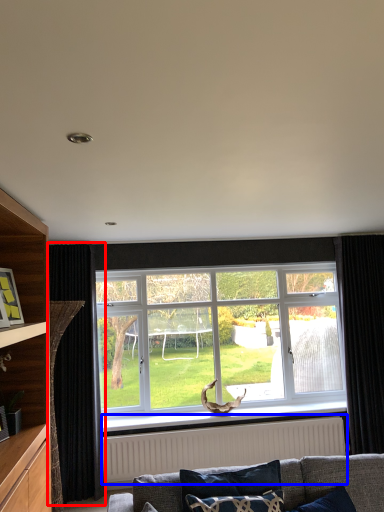
Question: Which point is further to the camera, curtain (highlighted by a red box) or radiator (highlighted by a blue box)?

Choices:
 (A) curtain
 (B) radiator

Answer: (B)